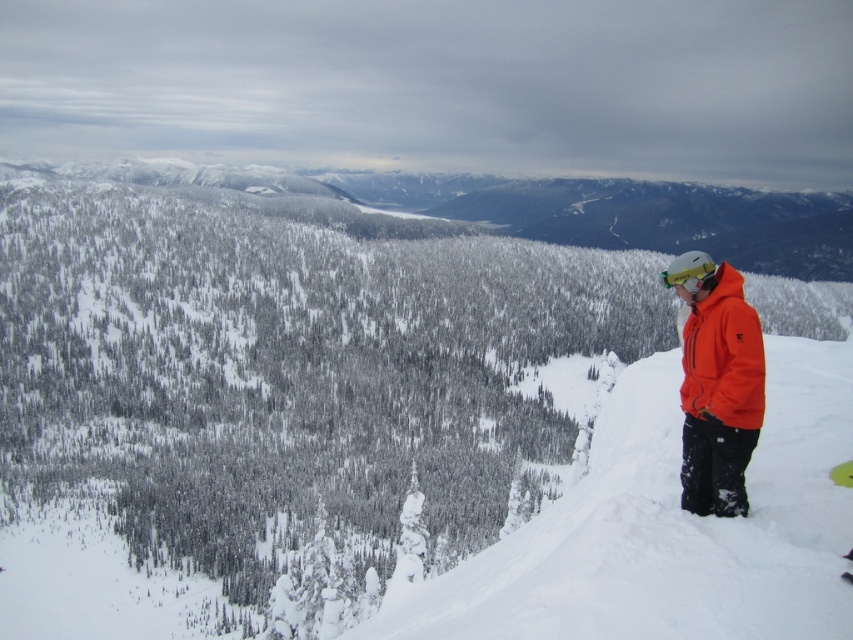
Question: Which is nearer to the white fluffy snow at upper right?

Choices:
 (A) yellow matte snowboard at lower right
 (B) white snow ski slope at right

Answer: (B)

Question: Which is farther from the yellow matte snowboard at lower right?

Choices:
 (A) white fluffy snow at upper right
 (B) orange softshell jacket at right

Answer: (A)

Question: Can you confirm if white fluffy snow at upper right is thinner than white snow ski slope at right?

Choices:
 (A) yes
 (B) no

Answer: (B)

Question: Which of these objects is positioned farthest from the white snow ski slope at right?

Choices:
 (A) white fluffy snow at upper right
 (B) orange softshell jacket at right
 (C) yellow matte snowboard at lower right
 (D) matte yellow goggles at right

Answer: (A)

Question: Does orange softshell jacket at right lie behind matte yellow goggles at right?

Choices:
 (A) no
 (B) yes

Answer: (A)

Question: Does matte yellow goggles at right have a greater width compared to yellow matte snowboard at lower right?

Choices:
 (A) no
 (B) yes

Answer: (B)